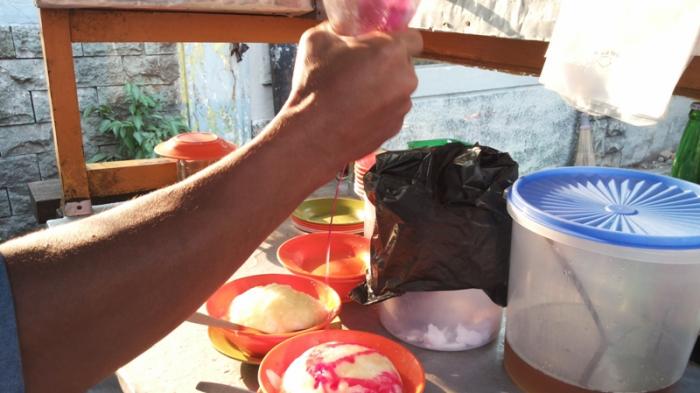
The height and width of the screenshot is (393, 700). I want to click on wooden beams, so click(60, 25), click(130, 25), click(206, 25), click(271, 25), click(59, 71), click(61, 140), click(66, 178), click(124, 178), click(453, 40), click(528, 46).